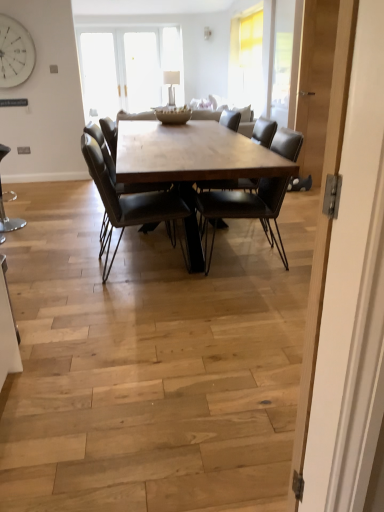
This screenshot has height=512, width=384. Describe the element at coordinates (347, 282) in the screenshot. I see `light wood door at center` at that location.

Locate an element on the screen. This screenshot has width=384, height=512. metallic stool at lower left, the 1th chair from the left is located at coordinates (8, 218).

You are a GUI agent. You are given a task and a screenshot of the screen. Output one action in this format:
    pyautogui.click(x=<x>, y=<y>)
    Task: Click on the light wood door at center
    The image size is (384, 512).
    Given the screenshot: What is the action you would take?
    pyautogui.click(x=347, y=282)

Which is in front, point (143, 175) or point (2, 42)?

Point (143, 175)

Would you say wooden table at center is outside white matte clock at upper left?

Yes, wooden table at center is located beyond the bounds of white matte clock at upper left.

Considering the positions of objects wooden table at center and white matte clock at upper left in the image provided, who is behind, wooden table at center or white matte clock at upper left?

white matte clock at upper left is behind.

What's the angular difference between wooden table at center and white matte clock at upper left's facing directions?

They differ by 91 degrees in their facing directions.

Is point (1, 153) behind point (13, 73)?

No, it is in front of (13, 73).

Considering their positions, is metallic stool at lower left, which ranks as the third chair in right-to-left order, located in front of or behind white matte clock at upper left?

In the image, metallic stool at lower left, which ranks as the third chair in right-to-left order, appears in front of white matte clock at upper left.

Considering the sizes of metallic stool at lower left, which ranks as the third chair in right-to-left order, and white matte clock at upper left in the image, is metallic stool at lower left, which ranks as the third chair in right-to-left order, wider or thinner than white matte clock at upper left?

In the image, metallic stool at lower left, which ranks as the third chair in right-to-left order, appears to be wider than white matte clock at upper left.

Based on the photo, considering the sizes of objects metallic stool at lower left, the 1th chair from the left, and white matte clock at upper left in the image provided, who is bigger, metallic stool at lower left, the 1th chair from the left, or white matte clock at upper left?

metallic stool at lower left, the 1th chair from the left, is bigger.

From the picture: Considering the sizes of leather chair at center, which is the 2th chair from left to right, and matte black chair at center, which ranks as the third chair in left-to-right order, in the image, is leather chair at center, which is the 2th chair from left to right, bigger or smaller than matte black chair at center, which ranks as the third chair in left-to-right order,?

In the image, leather chair at center, which is the 2th chair from left to right, appears to be larger than matte black chair at center, which ranks as the third chair in left-to-right order.

Does leather chair at center, marked as the second chair in a right-to-left arrangement, contain matte black chair at center, the first chair positioned from the right?

No, matte black chair at center, the first chair positioned from the right, is not surrounded by leather chair at center, marked as the second chair in a right-to-left arrangement.

Is leather chair at center, marked as the second chair in a right-to-left arrangement, at the right side of matte black chair at center, which ranks as the third chair in left-to-right order?

No, leather chair at center, marked as the second chair in a right-to-left arrangement, is not to the right of matte black chair at center, which ranks as the third chair in left-to-right order.

Which object is further away from the camera taking this photo, leather chair at center, which is the 2th chair from left to right, or matte black chair at center, the first chair positioned from the right?

matte black chair at center, the first chair positioned from the right, is further from the camera.

This screenshot has height=512, width=384. In order to click on chair on the right of wooden table at center in this screenshot , I will do `click(245, 209)`.

Considering the sizes of matte black chair at center, which ranks as the third chair in left-to-right order, and wooden table at center in the image, is matte black chair at center, which ranks as the third chair in left-to-right order, wider or thinner than wooden table at center?

In the image, matte black chair at center, which ranks as the third chair in left-to-right order, appears to be more narrow than wooden table at center.

Considering the positions of point (291, 149) and point (211, 178), is point (291, 149) closer or farther from the camera than point (211, 178)?

Point (291, 149) is farther from the camera than point (211, 178).

Would you say light wood door at center is part of leather chair at center, marked as the second chair in a right-to-left arrangement,'s contents?

No, light wood door at center is not inside leather chair at center, marked as the second chair in a right-to-left arrangement.

How distant is leather chair at center, which is the 2th chair from left to right, from light wood door at center?

leather chair at center, which is the 2th chair from left to right, and light wood door at center are 2.03 meters apart.

Between leather chair at center, marked as the second chair in a right-to-left arrangement, and light wood door at center, which one has more height?

With more height is light wood door at center.

Is leather chair at center, which is the 2th chair from left to right, far from light wood door at center?

leather chair at center, which is the 2th chair from left to right, is positioned a significant distance from light wood door at center.

Based on their positions, is matte black chair at center, the first chair positioned from the right, located to the left or right of light wood door at center?

Based on their positions, matte black chair at center, the first chair positioned from the right, is located to the right of light wood door at center.

Does matte black chair at center, the first chair positioned from the right, lie in front of light wood door at center?

No, the depth of matte black chair at center, the first chair positioned from the right, is greater than that of light wood door at center.

Could you tell me if matte black chair at center, which ranks as the third chair in left-to-right order, is turned towards light wood door at center?

No, matte black chair at center, which ranks as the third chair in left-to-right order, is not facing towards light wood door at center.

What's the angular difference between matte black chair at center, the first chair positioned from the right, and light wood door at center's facing directions?

The facing directions of matte black chair at center, the first chair positioned from the right, and light wood door at center are 74.6 degrees apart.

Can you confirm if wooden table at center is positioned to the right of matte black chair at center, which ranks as the third chair in left-to-right order?

No, wooden table at center is not to the right of matte black chair at center, which ranks as the third chair in left-to-right order.

Where is `the 1st chair below the wooden table at center (from the image's perspective)`? The width and height of the screenshot is (384, 512). the 1st chair below the wooden table at center (from the image's perspective) is located at coordinates (245, 209).

What's the angular difference between wooden table at center and matte black chair at center, the first chair positioned from the right,'s facing directions?

wooden table at center and matte black chair at center, the first chair positioned from the right, are facing 2.87 degrees away from each other.

Can you confirm if wooden table at center is wider than matte black chair at center, the first chair positioned from the right?

Indeed, wooden table at center has a greater width compared to matte black chair at center, the first chair positioned from the right.

This screenshot has height=512, width=384. I want to click on clock above the wooden table at center (from a real-world perspective), so click(x=15, y=53).

Identify the location of the 1st chair to the right of the white matte clock at upper left, starting your count from the anchor. This screenshot has height=512, width=384. (8, 218).

Considering their positions, is white matte clock at upper left positioned closer to matte black chair at center, the first chair positioned from the right, than light wood door at center?

light wood door at center lies closer to matte black chair at center, the first chair positioned from the right, than the other object.

Estimate the real-world distances between objects in this image. Which object is closer to metallic stool at lower left, which ranks as the third chair in right-to-left order, light wood door at center or wooden table at center?

The object closer to metallic stool at lower left, which ranks as the third chair in right-to-left order, is wooden table at center.

Looking at the image, which one is located closer to wooden table at center, matte black chair at center, which ranks as the third chair in left-to-right order, or light wood door at center?

The object closer to wooden table at center is matte black chair at center, which ranks as the third chair in left-to-right order.

Estimate the real-world distances between objects in this image. Which object is closer to leather chair at center, marked as the second chair in a right-to-left arrangement, light wood door at center or white matte clock at upper left?

light wood door at center is closer to leather chair at center, marked as the second chair in a right-to-left arrangement.

Looking at the image, which one is located closer to wooden table at center, white matte clock at upper left or matte black chair at center, which ranks as the third chair in left-to-right order?

matte black chair at center, which ranks as the third chair in left-to-right order, is positioned closer to the anchor wooden table at center.

Based on their spatial positions, is matte black chair at center, which ranks as the third chair in left-to-right order, or leather chair at center, marked as the second chair in a right-to-left arrangement, closer to wooden table at center?

leather chair at center, marked as the second chair in a right-to-left arrangement, is closer to wooden table at center.

Based on their spatial positions, is light wood door at center or leather chair at center, marked as the second chair in a right-to-left arrangement, further from wooden table at center?

Among the two, light wood door at center is located further to wooden table at center.

Which object lies further to the anchor point matte black chair at center, which ranks as the third chair in left-to-right order, leather chair at center, which is the 2th chair from left to right, or white matte clock at upper left?

The object further to matte black chair at center, which ranks as the third chair in left-to-right order, is white matte clock at upper left.

At what (x,y) coordinates should I click in order to perform the action: click on coffee table located between metallic stool at lower left, the 1th chair from the left, and matte black chair at center, the first chair positioned from the right, in the left-right direction. Please return your answer as a coordinate pair (x, y). Looking at the image, I should click on (186, 159).

I want to click on coffee table between leather chair at center, which is the 2th chair from left to right, and matte black chair at center, the first chair positioned from the right, in the horizontal direction, so click(186, 159).

Locate an element on the screen. The height and width of the screenshot is (512, 384). chair positioned between light wood door at center and matte black chair at center, the first chair positioned from the right, from near to far is located at coordinates (129, 202).

At what (x,y) coordinates should I click in order to perform the action: click on coffee table between light wood door at center and white matte clock at upper left from front to back. Please return your answer as a coordinate pair (x, y). The height and width of the screenshot is (512, 384). Looking at the image, I should click on (186, 159).